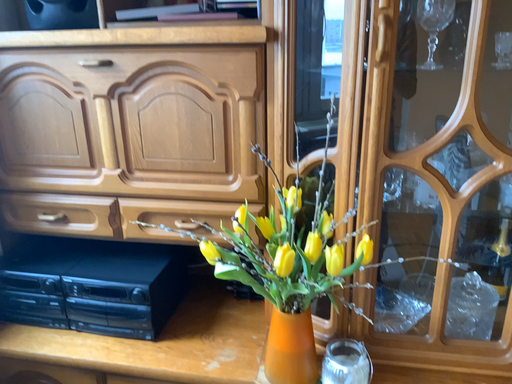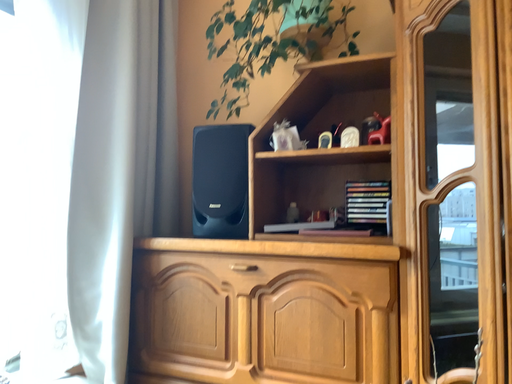
Question: Which way did the camera rotate in the video?

Choices:
 (A) rotated right
 (B) rotated left

Answer: (B)